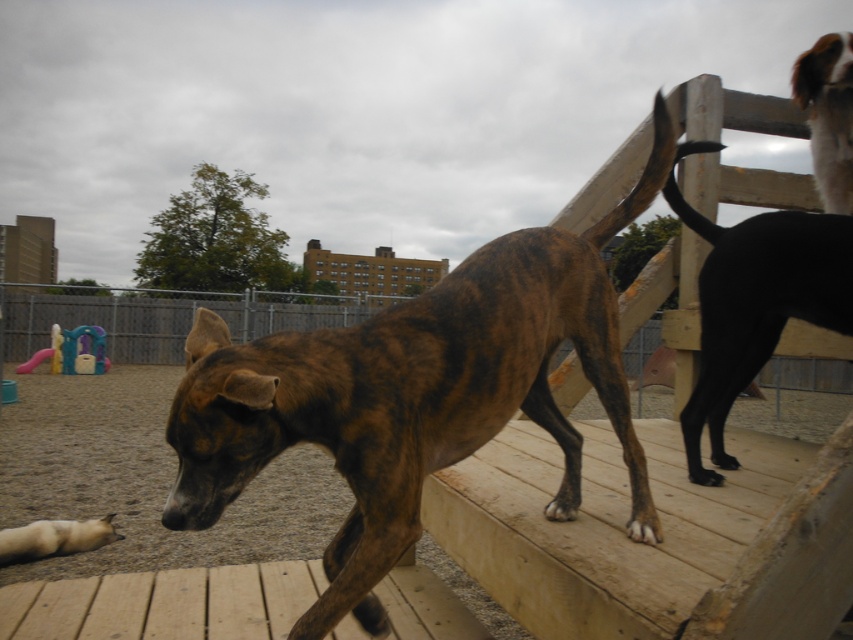
You are a dog owner who wants to throw a ball for your brindle dog. The black glossy dog at upper right is nearby. How far apart are the two dogs?

The two dogs are 1.73 meters apart.

Based on the photo, you are a dog owner who wants to ensure your dog stays within the park. You see the black glossy dog at upper right and the brown brindle dog at upper right. Which dog is closer to the fence?

The black glossy dog at upper right is positioned on the left side of brown brindle dog at upper right, so the brown brindle dog at upper right is closer to the fence.

You are a dog owner who wants to ensure your dog has enough space to move freely in the park. Based on the image, which dog, the black glossy dog at upper right or the brown brindle dog at upper right, requires more space due to its size?

The black glossy dog at upper right requires more space because it is larger in size compared to the brown brindle dog at upper right.